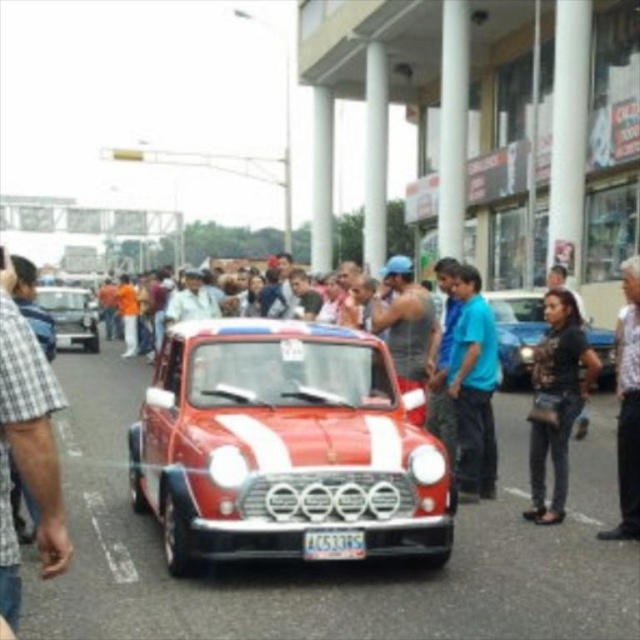
You are a photographer at the car show and want to capture both the shiny red car at center and the white textured shirt at right in a single frame. Which object should you focus on first to ensure both are in the frame?

The shiny red car at center occupies less space than the white textured shirt at right, so you should focus on the white textured shirt at right first to ensure both fit within the frame.

You are standing in the street scene and want to take a photo of both point [257,531] and point [637,291]. Which point should you focus on first to ensure both are in focus?

You should focus on point [257,531] first since it is closer to the camera than point [637,291].

You are a photographer trying to capture a clear shot of both the camouflage fabric jacket at center and the shiny black car at left. Based on their positions, which object is closer to the camera?

The camouflage fabric jacket at center is located below the shiny black car at left, meaning it is closer to the camera since it appears lower in the image.